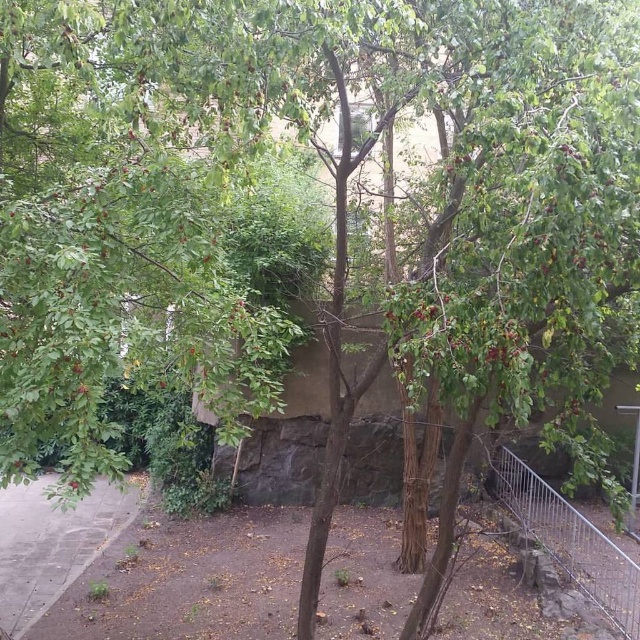
You are a gardener observing the outdoor scene. You notice the silver metallic fence at right and the green matte leaves at center. Which object is positioned lower in the image?

The silver metallic fence at right is positioned below the green matte leaves at center, so it is lower in the image.